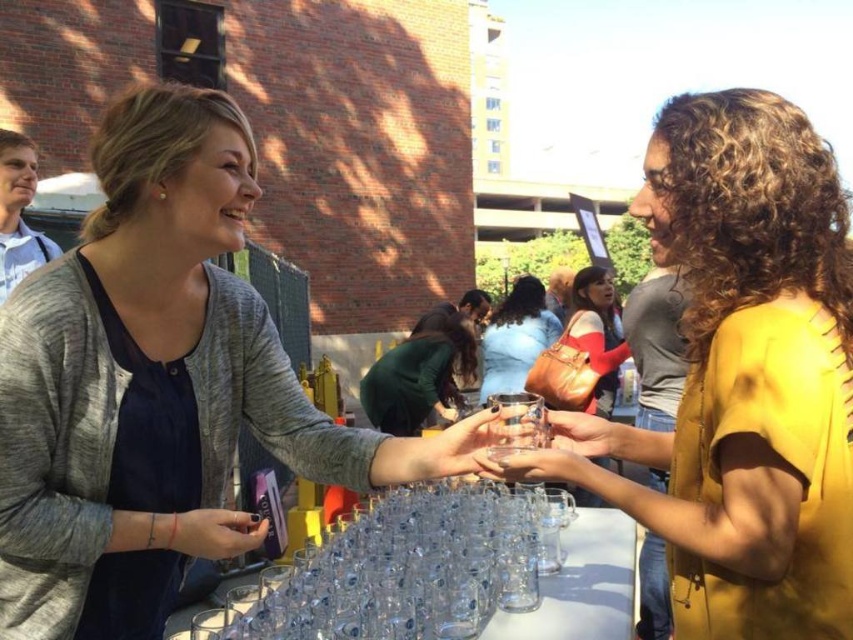
Between transparent glass cups at center and matte red shirt at center, which one has more height?

matte red shirt at center

From the picture: Can you confirm if transparent glass cups at center is taller than matte red shirt at center?

No.

Locate an element on the screen. Image resolution: width=853 pixels, height=640 pixels. transparent glass cups at center is located at coordinates (584, 584).

At what (x,y) coordinates should I click in order to perform the action: click on transparent glass cups at center. Please return your answer as a coordinate pair (x, y). The height and width of the screenshot is (640, 853). Looking at the image, I should click on (584, 584).

How far apart are matte gray cardigan at center and matte red shirt at center?

The distance of matte gray cardigan at center from matte red shirt at center is 8.85 feet.

Is matte gray cardigan at center wider than matte red shirt at center?

Yes.

Where is `matte gray cardigan at center`? matte gray cardigan at center is located at coordinates (157, 385).

Consider the image. Does yellow matte shirt at center have a smaller size compared to matte red shirt at center?

No.

Does yellow matte shirt at center appear under matte red shirt at center?

Indeed, yellow matte shirt at center is positioned under matte red shirt at center.

Is point (848, 566) positioned in front of point (596, 308)?

Yes, it is in front of point (596, 308).

I want to click on yellow matte shirt at center, so click(x=741, y=376).